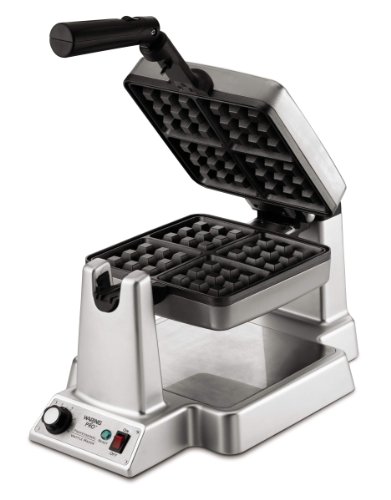
Where is `black frame around the switch`? The width and height of the screenshot is (391, 500). black frame around the switch is located at coordinates (124, 447).